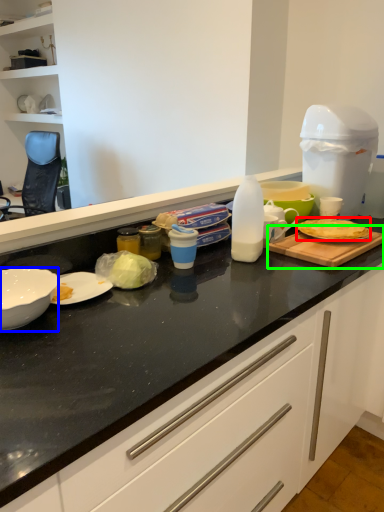
Question: Estimate the real-world distances between objects in this image. Which object is farther from food (highlighted by a red box), kitchen appliance (highlighted by a blue box) or cutting board (highlighted by a green box)?

Choices:
 (A) kitchen appliance
 (B) cutting board

Answer: (A)